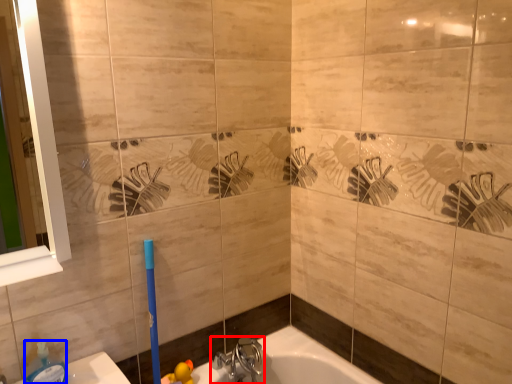
Question: Which object is closer to the camera taking this photo, tap (highlighted by a red box) or soap dispenser (highlighted by a blue box)?

Choices:
 (A) tap
 (B) soap dispenser

Answer: (B)